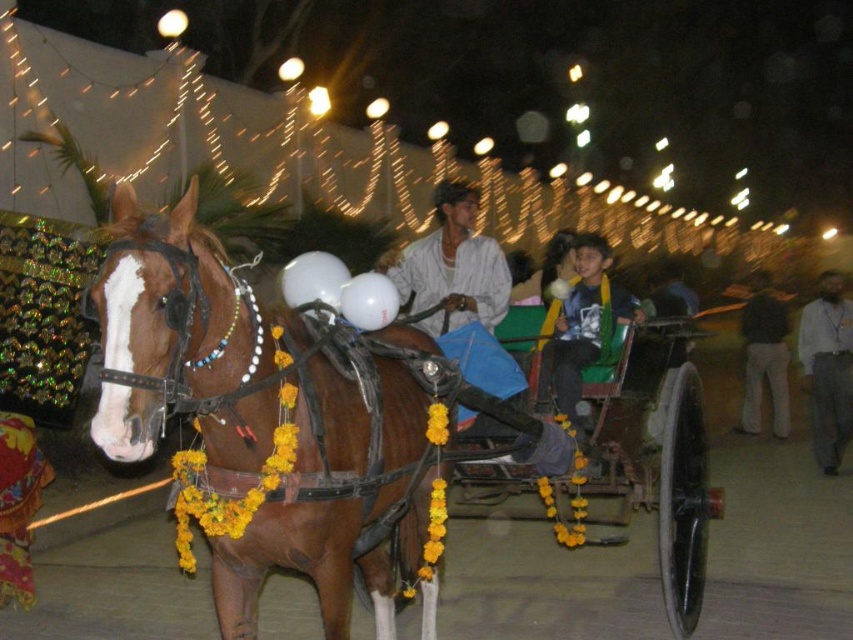
Question: Does brown glossy horse at left come behind beige fabric shirt at right?

Choices:
 (A) no
 (B) yes

Answer: (A)

Question: Which point is farther from the camera taking this photo?

Choices:
 (A) (776, 410)
 (B) (479, 289)

Answer: (A)

Question: Which point appears farthest from the camera in this image?

Choices:
 (A) (460, 273)
 (B) (833, 312)
 (C) (164, 284)

Answer: (B)

Question: Which of the following is the closest to the observer?

Choices:
 (A) dark gray sweater at right
 (B) beige fabric shirt at right
 (C) brown glossy horse at left

Answer: (C)

Question: Does brown glossy horse at left have a lesser width compared to light brown fabric shirt at center?

Choices:
 (A) yes
 (B) no

Answer: (B)

Question: Can you confirm if light brown fabric shirt at center is thinner than dark gray sweater at right?

Choices:
 (A) no
 (B) yes

Answer: (B)